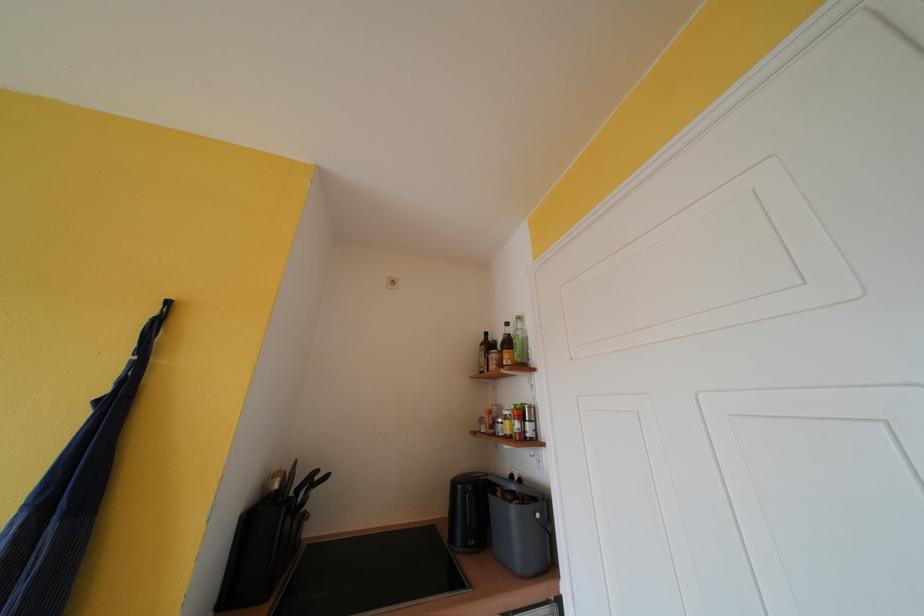
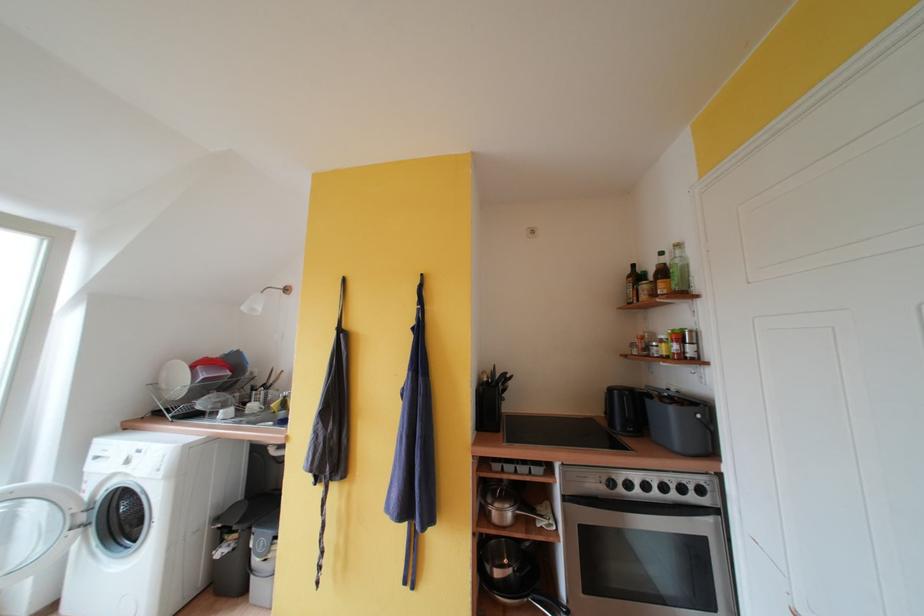
In the second image, find the point that corresponds to point 524,428 in the first image.

(682, 350)